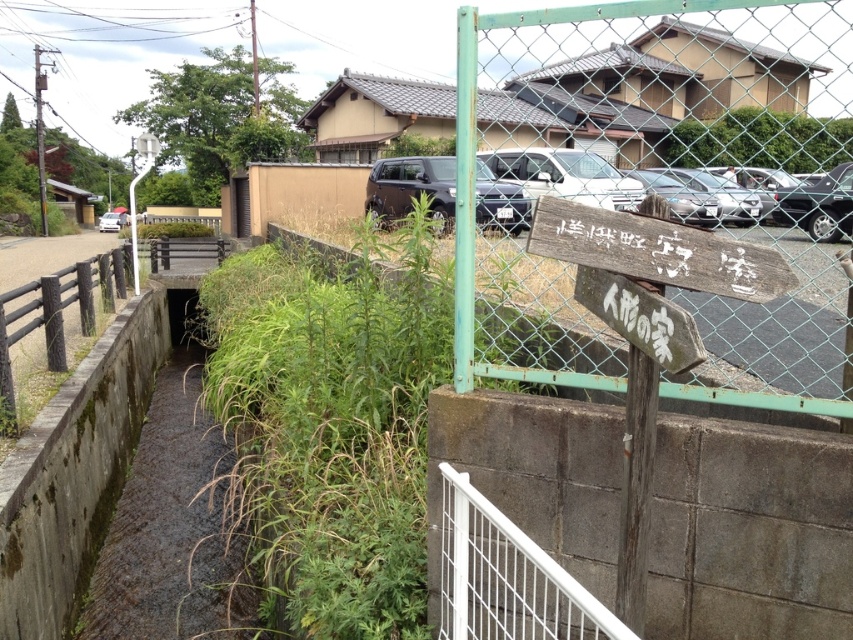
You are a delivery driver who needs to park your dark gray metallic suv at center in a space that is only as wide as the brown wooden rail at left. Can your vehicle fit in that space?

The dark gray metallic suv at center might be wider than the brown wooden rail at left, so there is a possibility that the SUV cannot fit into the parking space if it is only as wide as the rail.

You are a pedestrian standing on the sidewalk and see the dark gray metallic suv at center and the brown wooden rail at left. Which object is closer to you?

The dark gray metallic suv at center is closer to you because it is in front of the brown wooden rail at left.